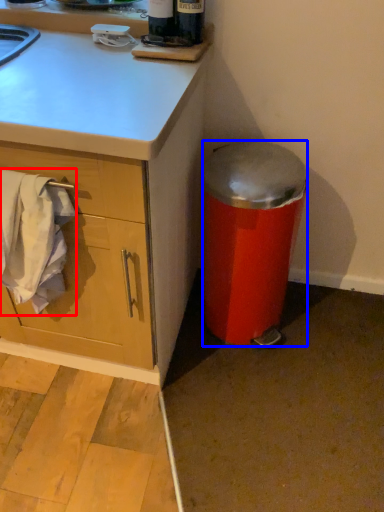
Question: Among these objects, which one is farthest to the camera, laundry (highlighted by a red box) or trash bin/can (highlighted by a blue box)?

Choices:
 (A) laundry
 (B) trash bin/can

Answer: (B)